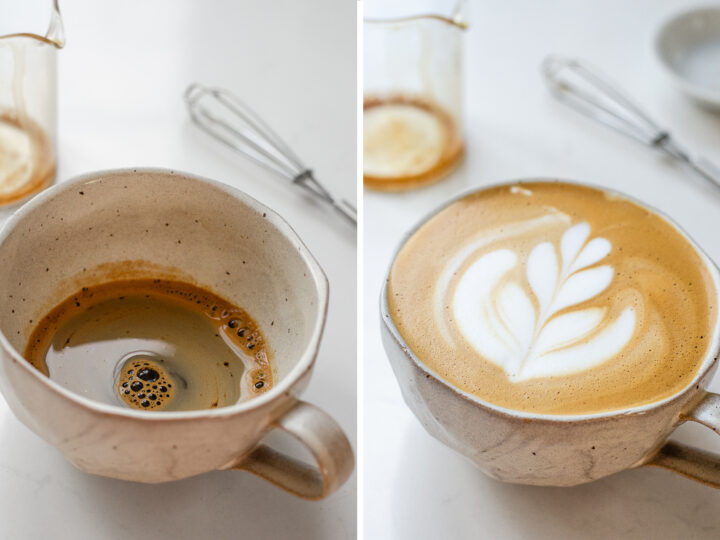
The width and height of the screenshot is (720, 540). Identify the location of measuring cup. (31, 56), (389, 31).